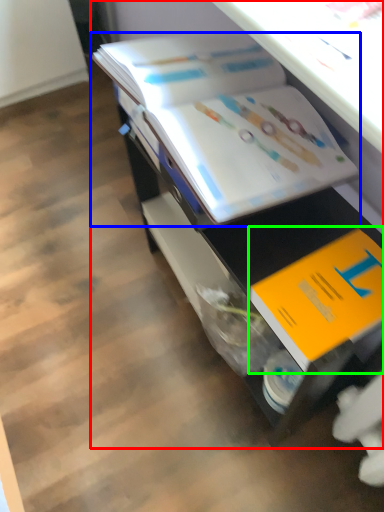
Question: Considering the real-world distances, which object is farthest from desk (highlighted by a red box)? book (highlighted by a blue box) or book (highlighted by a green box)?

Choices:
 (A) book
 (B) book

Answer: (B)